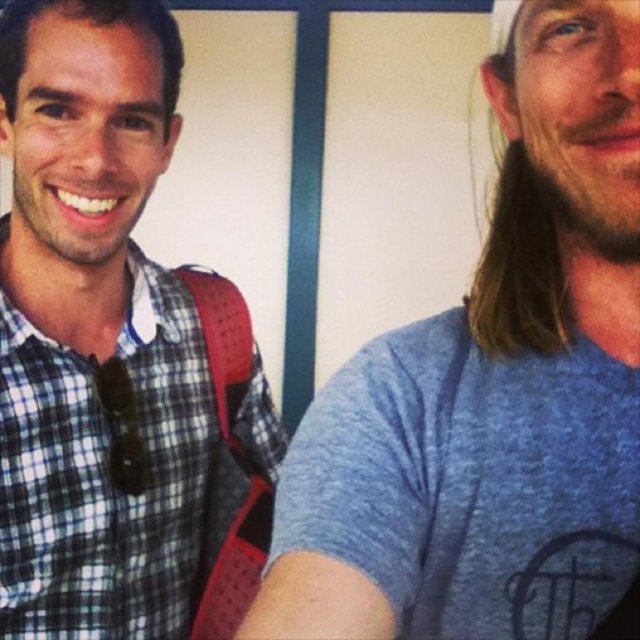
Which is below, blue cotton t-shirt at right or brown fuzzy beard at right?

blue cotton t-shirt at right

Between point (289, 598) and point (557, 157), which one is positioned in front?

Positioned in front is point (289, 598).

Locate an element on the screen. The image size is (640, 640). blue cotton t-shirt at right is located at coordinates (492, 388).

Based on the photo, which of these two, brown fuzzy beard at right or beardsoft hair at left, stands shorter?

With less height is brown fuzzy beard at right.

Does brown fuzzy beard at right have a greater width compared to beardsoft hair at left?

No, brown fuzzy beard at right is not wider than beardsoft hair at left.

At what (x,y) coordinates should I click in order to perform the action: click on brown fuzzy beard at right. Please return your answer as a coordinate pair (x, y). Looking at the image, I should click on (588, 163).

Locate an element on the screen. The width and height of the screenshot is (640, 640). brown fuzzy beard at right is located at coordinates (588, 163).

Is checkered fabric shirt at left above beardsoft hair at left?

No.

Is point (45, 336) positioned before point (17, 173)?

No.

Where is `checkered fabric shirt at left`? checkered fabric shirt at left is located at coordinates (124, 460).